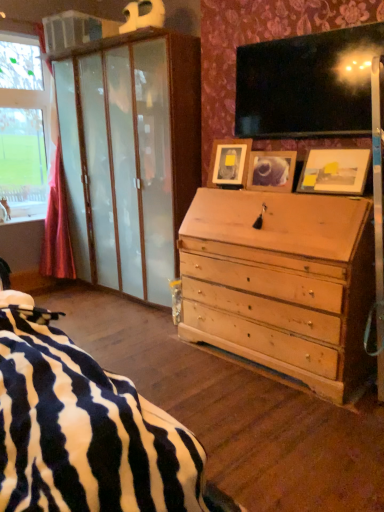
The width and height of the screenshot is (384, 512). What are the coordinates of `vacant area on top of wooden picture frame at center, positioned as the 2th picture frame in left-to-right order (from a real-world perspective)` in the screenshot? It's located at (282, 146).